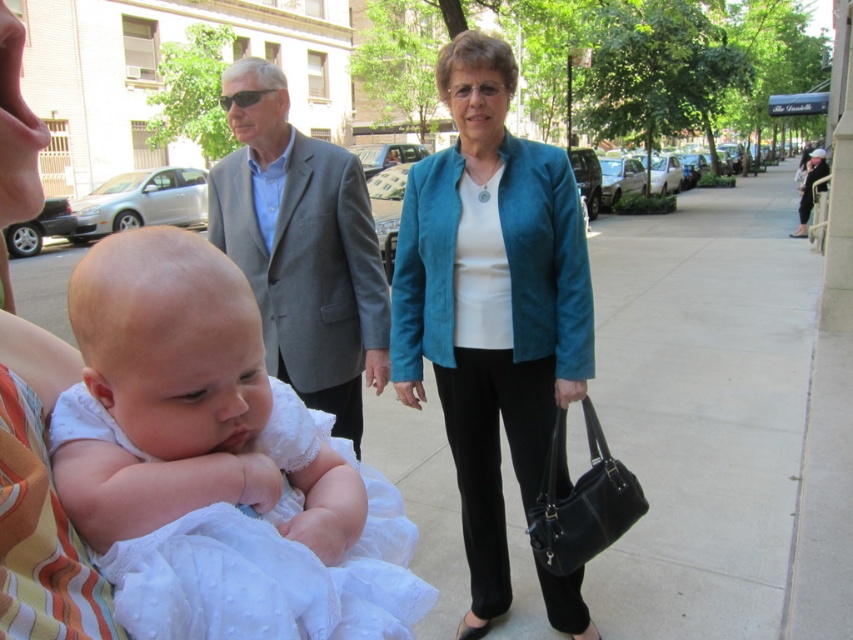
Question: Among these points, which one is nearest to the camera?

Choices:
 (A) (97, 592)
 (B) (602, 420)

Answer: (A)

Question: Observing the image, what is the correct spatial positioning of smooth concrete sidewalk at center in reference to gray fabric suit at center?

Choices:
 (A) above
 (B) below

Answer: (A)

Question: Is teal suede blazer at center wider than teal leather jacket at center?

Choices:
 (A) yes
 (B) no

Answer: (A)

Question: Which of the following is the closest to the observer?

Choices:
 (A) click(x=7, y=589)
 (B) click(x=375, y=376)
 (C) click(x=677, y=332)

Answer: (A)

Question: Which object is positioned farthest from the white satin dress at left?

Choices:
 (A) gray fabric suit at center
 (B) teal suede blazer at center
 (C) smooth concrete sidewalk at center

Answer: (C)

Question: Is gray fabric suit at center above teal leather jacket at center?

Choices:
 (A) no
 (B) yes

Answer: (B)